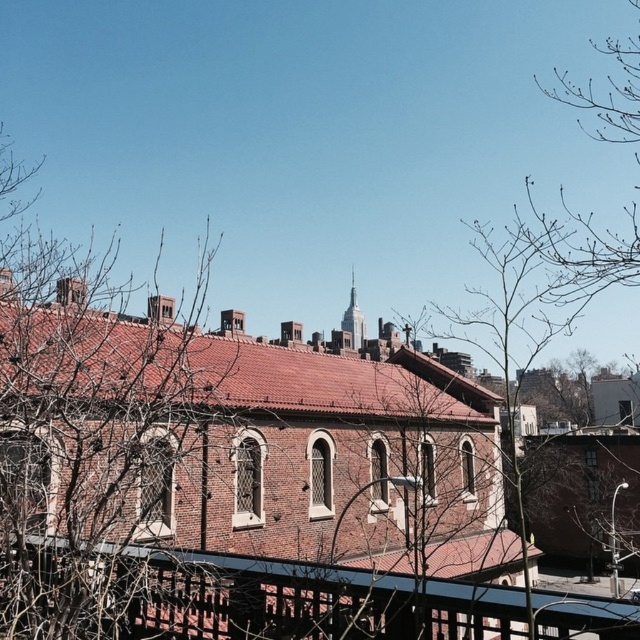
Looking at this image, you are standing in front of the brick building with a red roof and want to walk from point A to point B. Point A is at coordinate point [573,608] and point B is at coordinate point [362,337]. Since you can only move forward, will you be able to see point B from point A without any obstructions?

Point point [573,608] is in front of point [362,337], so when standing at point A, you will be able to see point B without any obstructions because there are no objects mentioned in the scene that block the line of sight between them.

You are standing in front of the brick building with a red roof and looking at the scene. Can you tell me the coordinates of the bare branches at left?

The bare branches at left are located at coordinates point (90, 435).